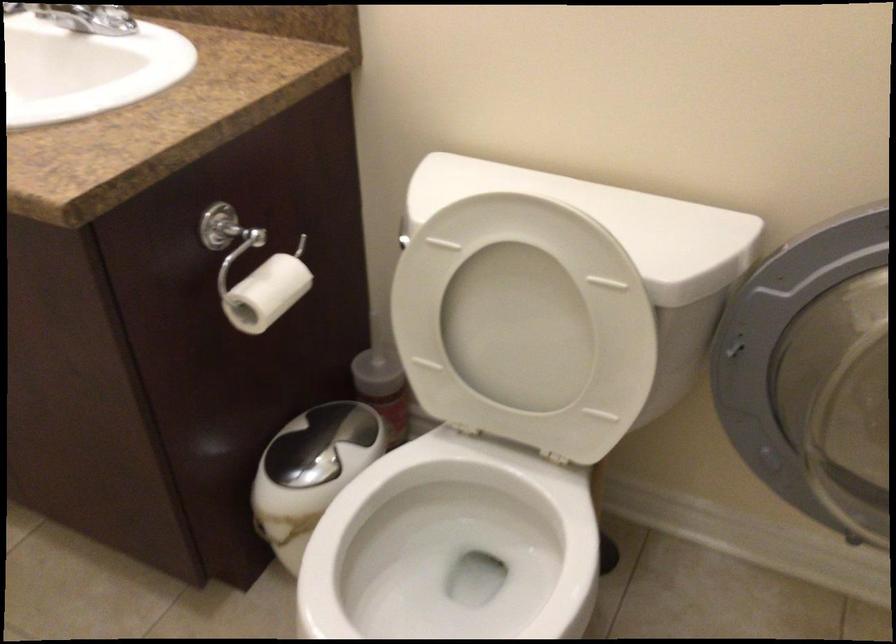
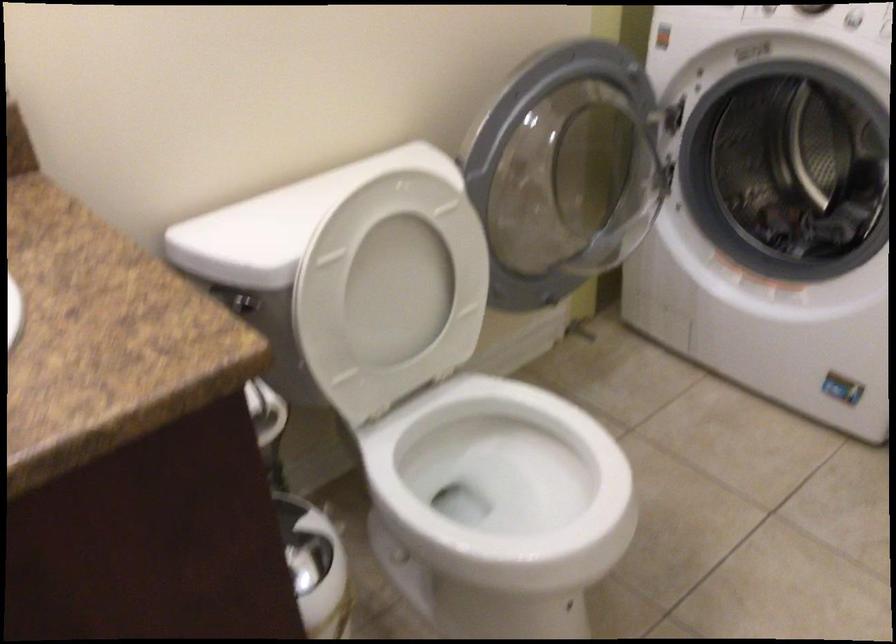
Question: The camera is either moving clockwise (left) or counter-clockwise (right) around the object. The first image is from the beginning of the video and the second image is from the end. Is the camera moving left or right when shooting the video?

Choices:
 (A) Left
 (B) Right

Answer: (A)